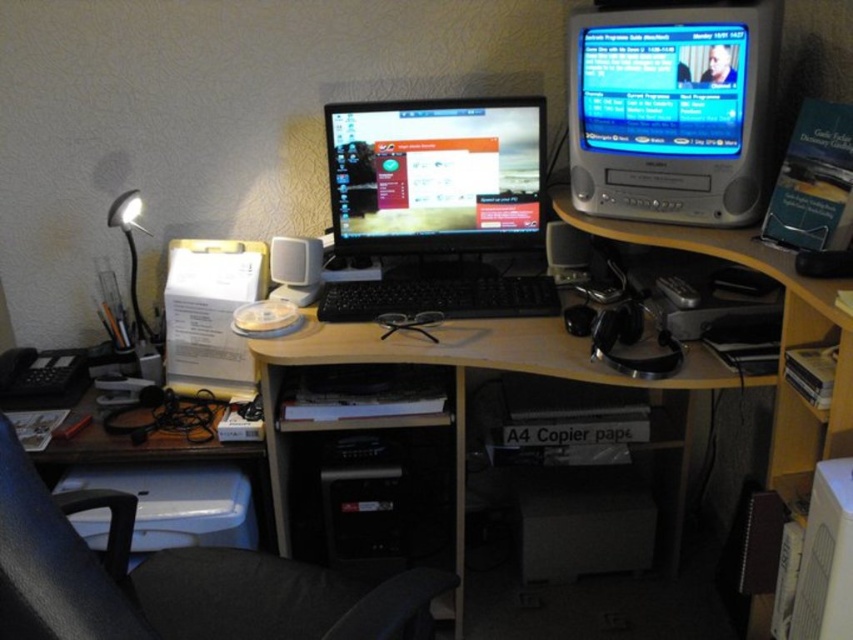
You are sitting in the black fabric swivel chair at lower left and want to reach the satin silver speaker at center on the desk. Based on their positions, can you easily grab it without moving your chair?

The black fabric swivel chair at lower left is closer to the viewer than the satin silver speaker at center, so the speaker is further away from you. You would need to lean forward or move your chair to reach it.

You are organizing the desk and need to place a new item between the black fabric swivel chair at lower left and the satin silver speaker at center. Based on their positions, where should you place the new item?

The new item should be placed between the black fabric swivel chair at lower left and the satin silver speaker at center, as the chair is to the left of the speaker.

You are organizing your home office and want to place a new rectangular box that is 15 cm wide between the silver metallic television at upper right and the white plastic speaker at center. Based on their widths, will the box fit in the space between them?

The silver metallic television at upper right is wider than the white plastic speaker at center. Since the box is 15 cm wide, it depends on the actual width difference between the two objects. However, without specific measurements, we cannot confirm if the space is sufficient.